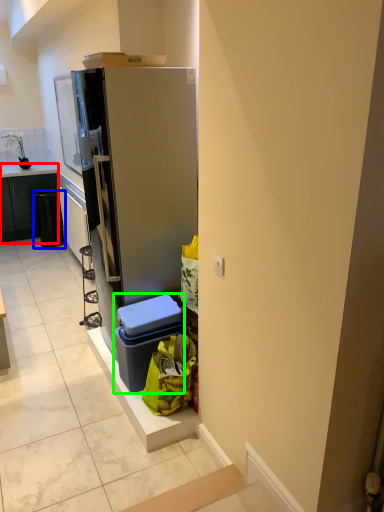
Question: Based on their relative distances, which object is nearer to cabinetry (highlighted by a red box)? Choose from recycling bin (highlighted by a blue box) and storage box (highlighted by a green box).

Choices:
 (A) recycling bin
 (B) storage box

Answer: (A)